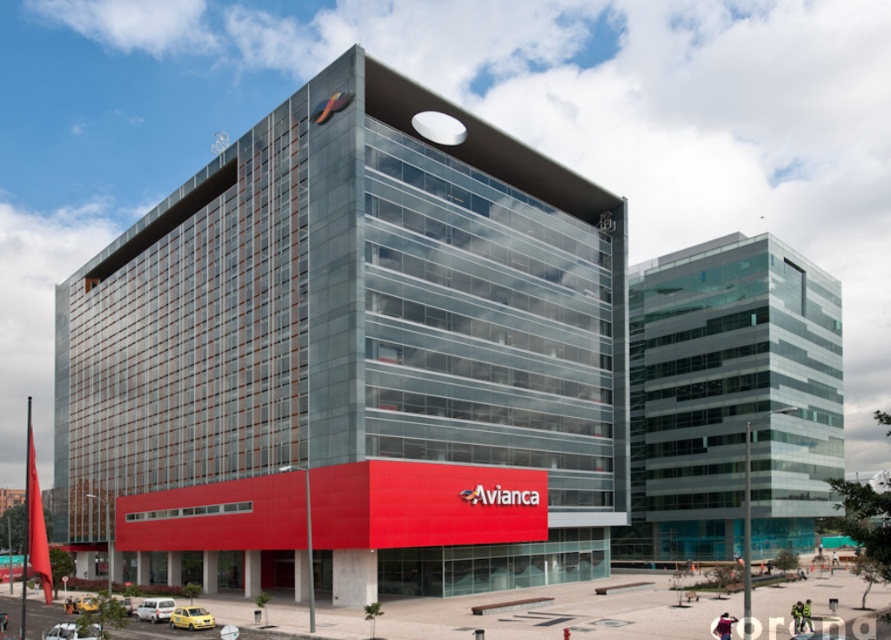
You are a drone operator trying to deliver a package to the glassy modern building at center. However, there is another transparent glass building at center in the way. Can you fly your drone through the space between them?

The glassy modern building at center is in front of the transparent glass building at center, so there is no space between them for the drone to fly through.

You are an architect evaluating two buildings in the city. You see the glassy modern building at center and the transparent glass building at center. Which one is wider?

The glassy modern building at center is wider than the transparent glass building at center according to the description provided.